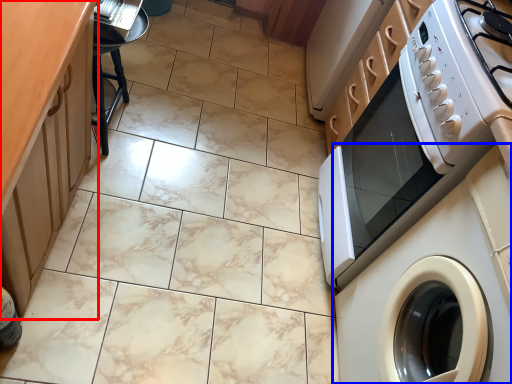
Question: Among these objects, which one is nearest to the camera, counter top (highlighted by a red box) or washing machine (highlighted by a blue box)?

Choices:
 (A) counter top
 (B) washing machine

Answer: (A)